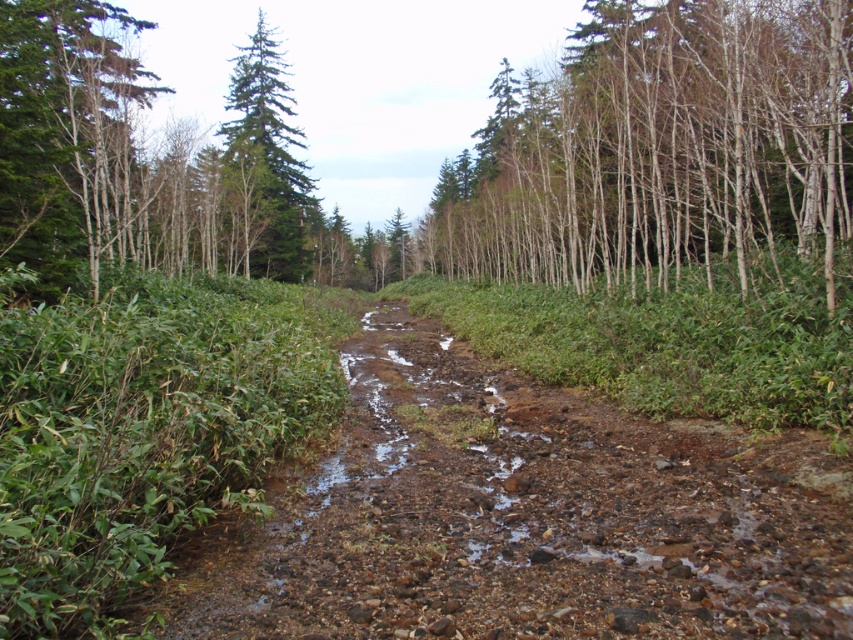
You are a GUI agent. You are given a task and a screenshot of the screen. Output one action in this format:
    pyautogui.click(x=<x>, y=<y>)
    Task: Click on the bare wood trees at upper right
    This screenshot has width=853, height=640.
    Given the screenshot: What is the action you would take?
    pyautogui.click(x=659, y=148)

Measure the distance between bare wood trees at upper right and green needle-like at upper center.

bare wood trees at upper right and green needle-like at upper center are 65.81 feet apart from each other.

Identify the location of bare wood trees at upper right. (659, 148).

The image size is (853, 640). Find the location of `bare wood trees at upper right`. bare wood trees at upper right is located at coordinates (659, 148).

Between point (834, 625) and point (509, 189), which one is positioned behind?

The point (509, 189) is behind.

Describe the element at coordinates (524, 516) in the screenshot. I see `brown rocky dirt track at center` at that location.

Locate an element on the screen. This screenshot has width=853, height=640. brown rocky dirt track at center is located at coordinates (524, 516).

Can you confirm if brown rocky dirt track at center is shorter than green needle-like at upper center?

Yes, brown rocky dirt track at center is shorter than green needle-like at upper center.

Find the location of a particular element. brown rocky dirt track at center is located at coordinates (524, 516).